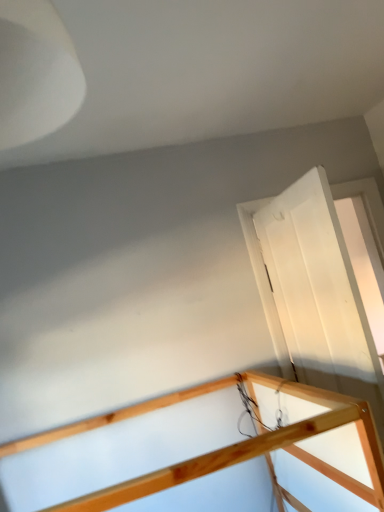
Question: From the image's perspective, is natural wood rail at upper right positioned above or below white glossy door at right?

Choices:
 (A) above
 (B) below

Answer: (B)

Question: Looking at the image, does natural wood rail at upper right seem bigger or smaller compared to white glossy door at right?

Choices:
 (A) big
 (B) small

Answer: (A)

Question: Looking at their shapes, would you say natural wood rail at upper right is wider or thinner than white glossy door at right?

Choices:
 (A) wide
 (B) thin

Answer: (A)

Question: In terms of size, does white glossy door at right appear bigger or smaller than natural wood rail at upper right?

Choices:
 (A) big
 (B) small

Answer: (B)

Question: From the image's perspective, is white glossy door at right above or below natural wood rail at upper right?

Choices:
 (A) above
 (B) below

Answer: (A)

Question: Relative to natural wood rail at upper right, is white glossy door at right in front or behind?

Choices:
 (A) behind
 (B) front

Answer: (A)

Question: Is white glossy door at right wider or thinner than natural wood rail at upper right?

Choices:
 (A) wide
 (B) thin

Answer: (B)